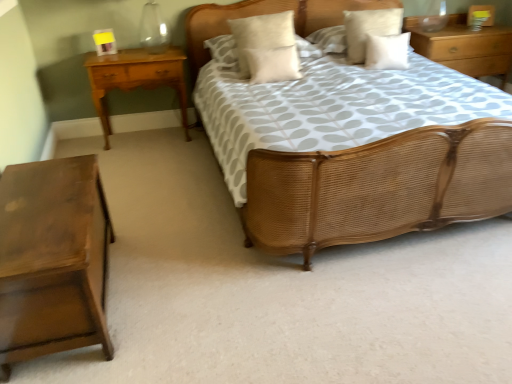
Where is `empty space that is to the right of dark brown wood nightstand at lower left, which ranks as the 2th nightstand in right-to-left order`? empty space that is to the right of dark brown wood nightstand at lower left, which ranks as the 2th nightstand in right-to-left order is located at coordinates (190, 292).